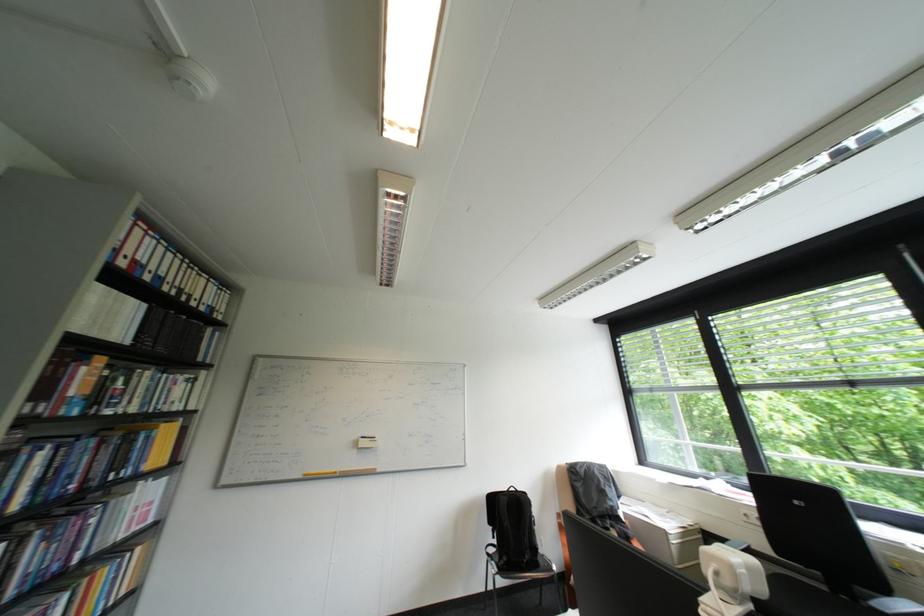
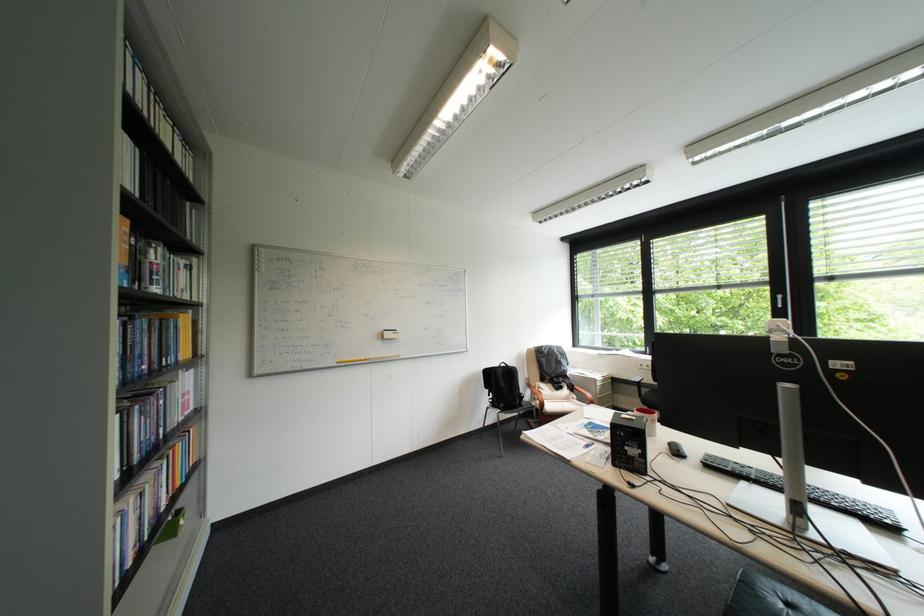
Where in the second image is the point corresponding to [103,446] from the first image?

(159, 326)